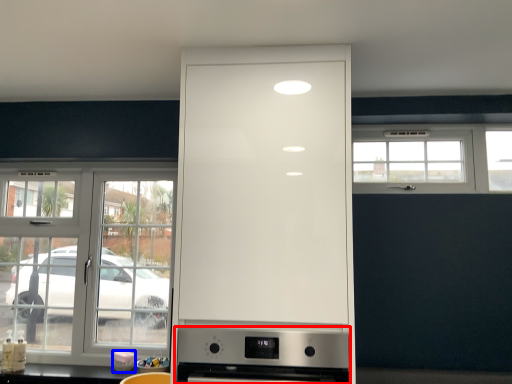
Question: Which of the following is the farthest to the observer, home appliance (highlighted by a red box) or appliance (highlighted by a blue box)?

Choices:
 (A) home appliance
 (B) appliance

Answer: (B)